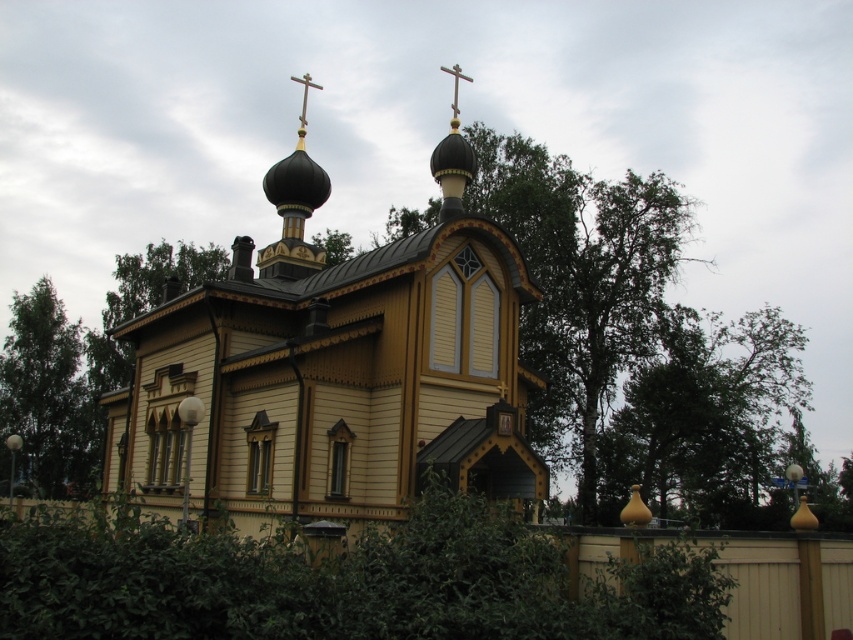
What do you see at coordinates (305, 96) in the screenshot? The image size is (853, 640). I see `metallic gold cross at upper center` at bounding box center [305, 96].

Can you confirm if metallic gold cross at upper center is thinner than white wooden cross at upper center?

Incorrect, metallic gold cross at upper center's width is not less than white wooden cross at upper center's.

Describe the element at coordinates (305, 96) in the screenshot. This screenshot has height=640, width=853. I see `metallic gold cross at upper center` at that location.

This screenshot has height=640, width=853. Find the location of `metallic gold cross at upper center`. metallic gold cross at upper center is located at coordinates (305, 96).

Which is behind, point (717, 326) or point (97, 444)?

The point (717, 326) is behind.

Find the location of a particular element. The image size is (853, 640). green leafy tree at center is located at coordinates (704, 417).

Can you confirm if wooden church at center is positioned to the right of green leafy tree at left?

Yes, wooden church at center is to the right of green leafy tree at left.

Can you confirm if wooden church at center is positioned below green leafy tree at left?

No.

Is point (286, 324) positioned behind point (67, 336)?

No, it is not.

Image resolution: width=853 pixels, height=640 pixels. In order to click on wooden church at center in this screenshot , I will do `click(335, 376)`.